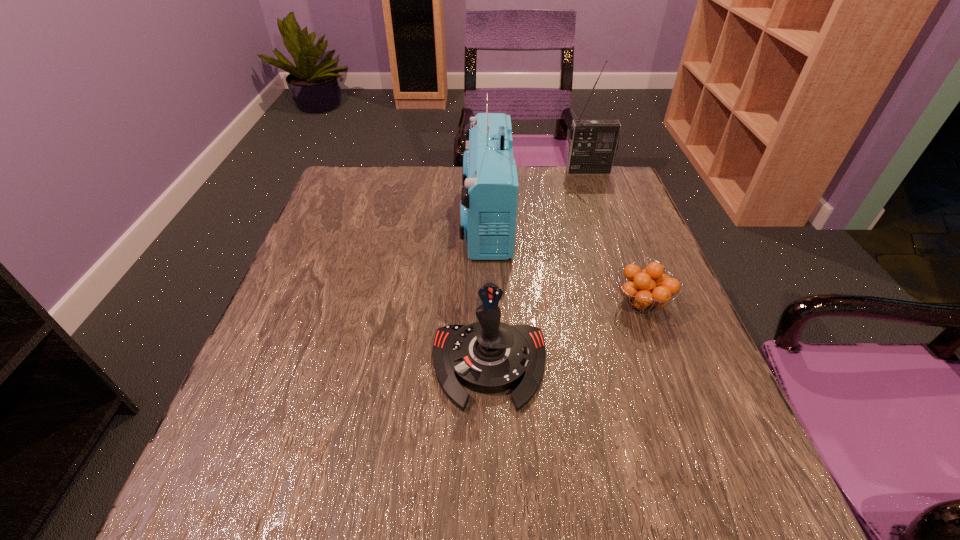
I want to click on the farthest object, so click(x=593, y=143).

Where is `the right radio receiver`? the right radio receiver is located at coordinates (593, 143).

Image resolution: width=960 pixels, height=540 pixels. What are the coordinates of `the second farthest object` in the screenshot? It's located at (489, 197).

The height and width of the screenshot is (540, 960). I want to click on the left radio receiver, so click(489, 197).

The width and height of the screenshot is (960, 540). What are the coordinates of `the second shortest object` in the screenshot? It's located at (489, 356).

Locate an element on the screen. joystick is located at coordinates (489, 356).

The width and height of the screenshot is (960, 540). I want to click on the third farthest object, so click(x=649, y=288).

Identify the location of orange fruit. (649, 288).

Where is `free space located on the display of the right radio receiver`? The width and height of the screenshot is (960, 540). free space located on the display of the right radio receiver is located at coordinates (594, 186).

I want to click on free region located on the front-facing side of the nearer radio receiver, so click(396, 219).